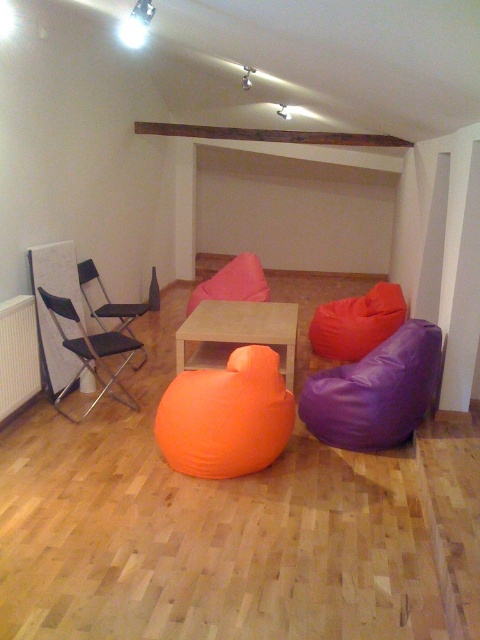
Can you confirm if wooden table at center is shorter than black fabric chair at left?

Yes, wooden table at center is shorter than black fabric chair at left.

Describe the element at coordinates (237, 333) in the screenshot. I see `wooden table at center` at that location.

Does point (297, 317) come in front of point (139, 314)?

Yes, it is in front of point (139, 314).

I want to click on wooden table at center, so [237, 333].

Is white matte radiator at left below matte black folding chair at left?

Incorrect, white matte radiator at left is not positioned below matte black folding chair at left.

Which is below, white matte radiator at left or matte black folding chair at left?

matte black folding chair at left

Between point (26, 376) and point (94, 364), which one is positioned behind?

Point (94, 364)

You are a GUI agent. You are given a task and a screenshot of the screen. Output one action in this format:
    pyautogui.click(x=<x>, y=<y>)
    Task: Click on the white matte radiator at left
    
    Given the screenshot: What is the action you would take?
    pyautogui.click(x=17, y=355)

Can you confirm if wooden table at center is positioned to the right of white matte radiator at left?

Correct, you'll find wooden table at center to the right of white matte radiator at left.

What do you see at coordinates (237, 333) in the screenshot? I see `wooden table at center` at bounding box center [237, 333].

Is point (214, 320) behind point (13, 369)?

Yes.

Locate an element on the screen. The height and width of the screenshot is (640, 480). wooden table at center is located at coordinates (237, 333).